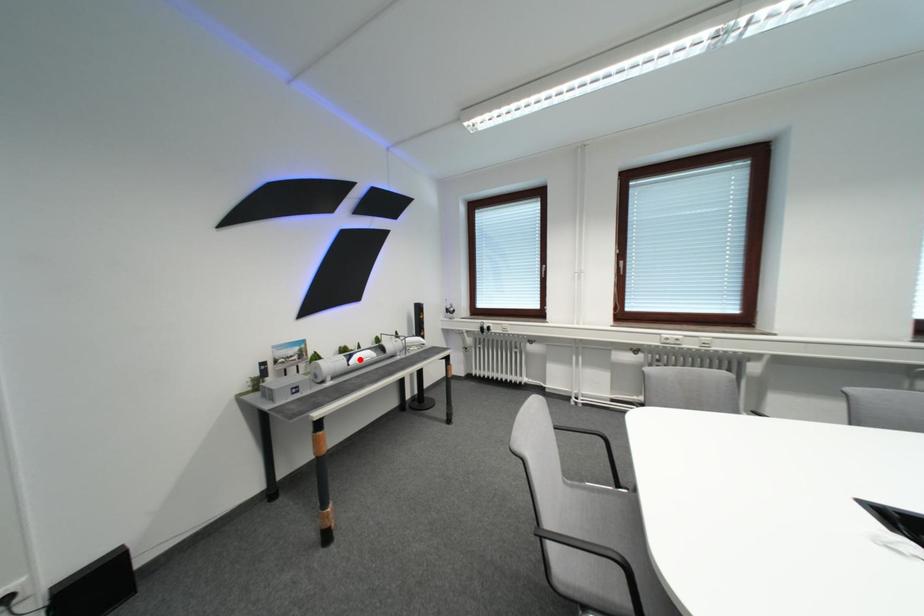
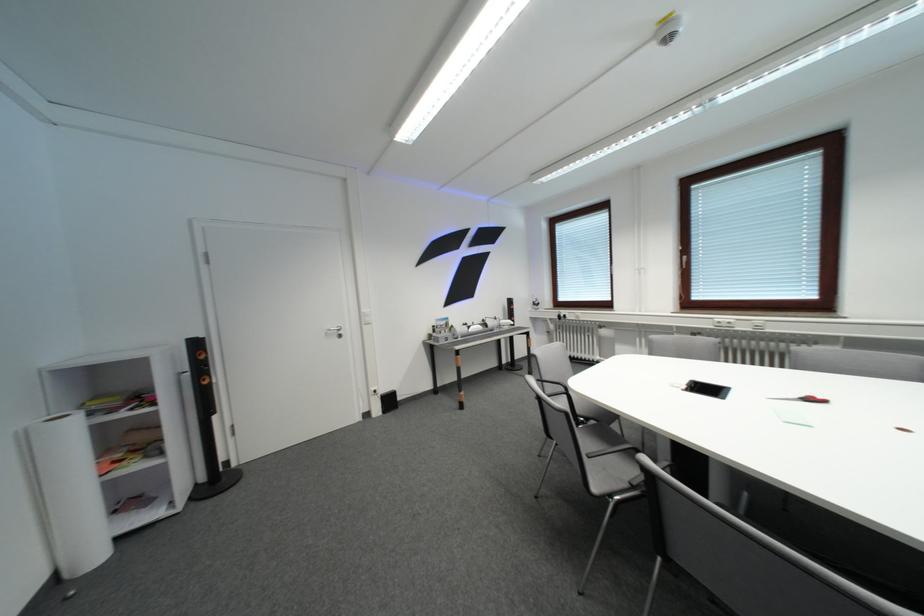
Find the pixel in the second image that matches the highlighted location in the first image.

(479, 330)